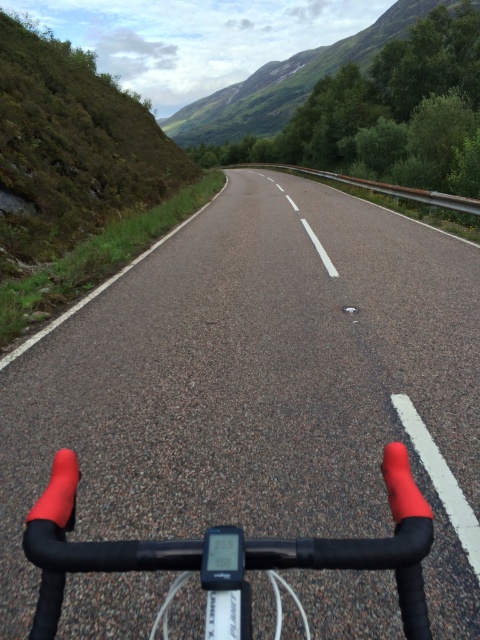
Between asphalt road at center and rubberized matte handlebars at center, which one is positioned higher?

asphalt road at center is higher up.

Between point (245, 404) and point (406, 573), which one is positioned in front?

Point (406, 573)

Image resolution: width=480 pixels, height=640 pixels. I want to click on asphalt road at center, so click(x=254, y=387).